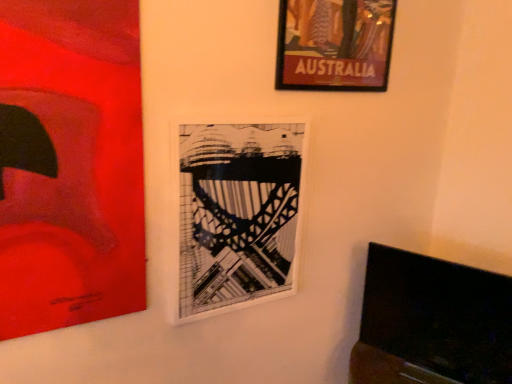
Question: From a real-world perspective, is white matte picture frame at center, which ranks as the 2th picture frame in left-to-right order, positioned above or below matte red painting at left, which appears as the 3th picture frame when viewed from the right?

Choices:
 (A) above
 (B) below

Answer: (B)

Question: Relative to matte red painting at left, which appears as the first picture frame when viewed from the left, is white matte picture frame at center, which ranks as the 2th picture frame in left-to-right order, in front or behind?

Choices:
 (A) behind
 (B) front

Answer: (A)

Question: Which object is the farthest from the white matte picture frame at center, which is the second picture frame from right to left?

Choices:
 (A) wooden-framed poster at upper right, arranged as the third picture frame when viewed from the left
 (B) matte red painting at left, which appears as the first picture frame when viewed from the left

Answer: (A)

Question: Based on their relative distances, which object is farther from the white matte picture frame at center, which ranks as the 2th picture frame in left-to-right order?

Choices:
 (A) wooden-framed poster at upper right, arranged as the third picture frame when viewed from the left
 (B) matte red painting at left, which appears as the 3th picture frame when viewed from the right

Answer: (A)